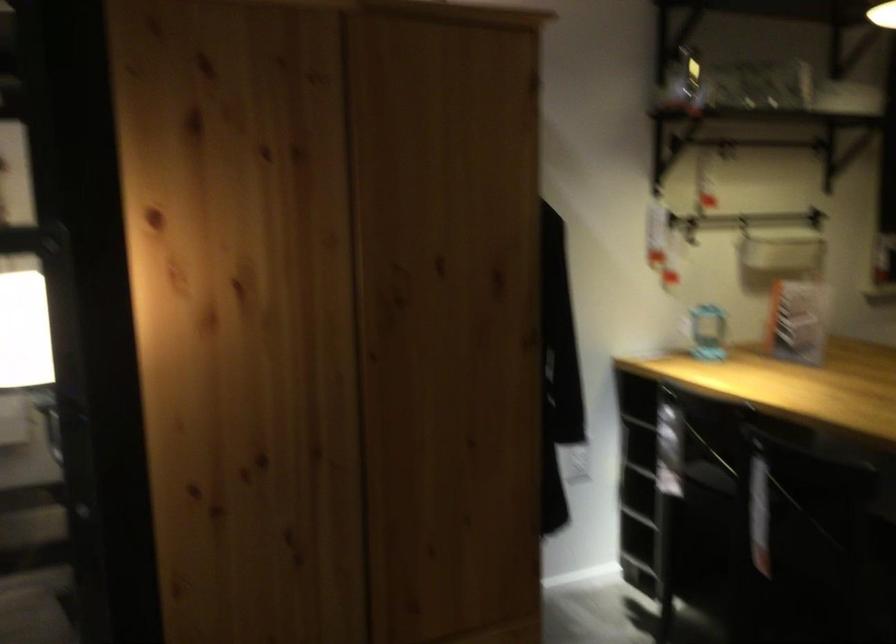
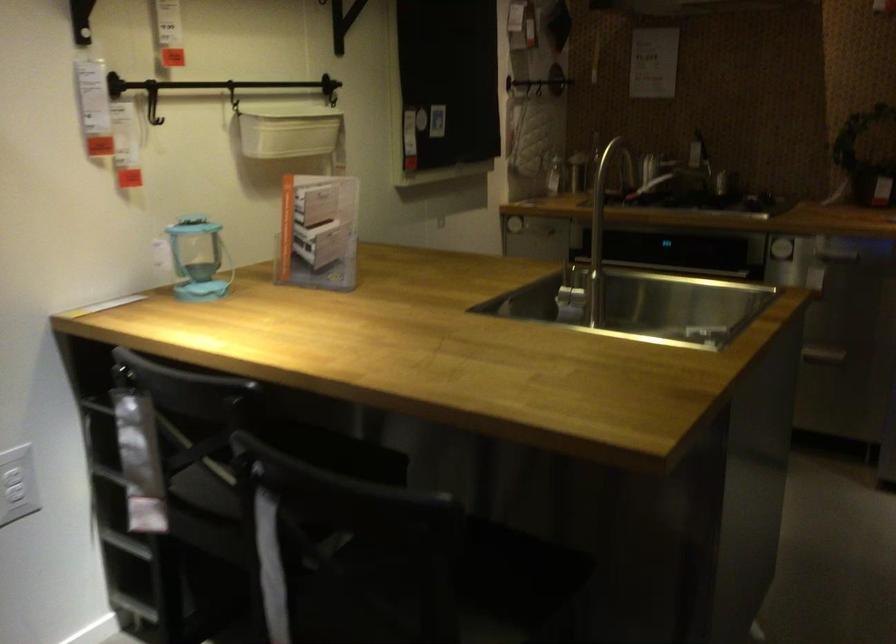
Find the pixel in the second image that matches (x=711, y=216) in the first image.

(152, 100)